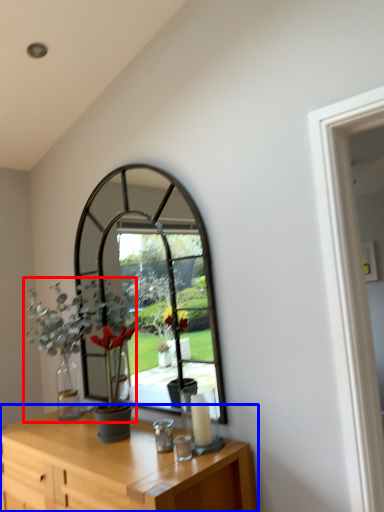
Question: Which of the following is the farthest to the observer, houseplant (highlighted by a red box) or table (highlighted by a blue box)?

Choices:
 (A) houseplant
 (B) table

Answer: (A)